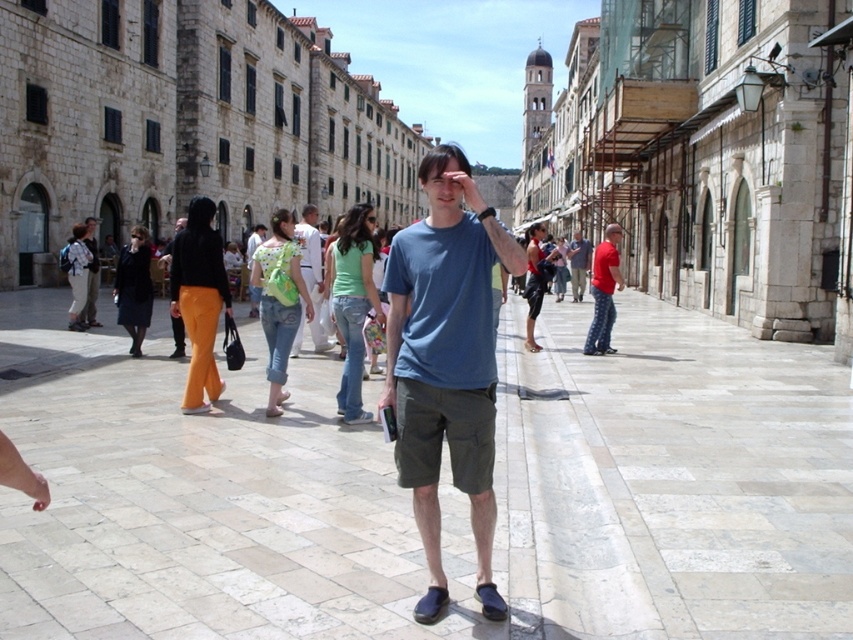
Looking at this image, can you confirm if matte green shirt at center is shorter than matte blue shirt at center?

In fact, matte green shirt at center may be taller than matte blue shirt at center.

Is matte green shirt at center thinner than matte blue shirt at center?

Incorrect, matte green shirt at center's width is not less than matte blue shirt at center's.

Is point (314, 305) farther from viewer compared to point (572, 292)?

No, (314, 305) is closer to viewer.

The height and width of the screenshot is (640, 853). What are the coordinates of `matte green shirt at center` in the screenshot? It's located at (311, 269).

Does orange pants at left have a greater height compared to matte blue shirt at center?

Incorrect, orange pants at left's height is not larger of matte blue shirt at center's.

Between point (91, 296) and point (575, 244), which one is positioned behind?

Point (575, 244)

Is point (86, 230) positioned after point (585, 273)?

No, (86, 230) is in front of (585, 273).

Locate an element on the screen. The image size is (853, 640). orange pants at left is located at coordinates (91, 276).

Locate an element on the screen. Image resolution: width=853 pixels, height=640 pixels. blue cotton t-shirt at center is located at coordinates (445, 362).

Is point (438, 317) positioned before point (93, 284)?

Yes, it is in front of point (93, 284).

Image resolution: width=853 pixels, height=640 pixels. In order to click on blue cotton t-shirt at center in this screenshot , I will do `click(445, 362)`.